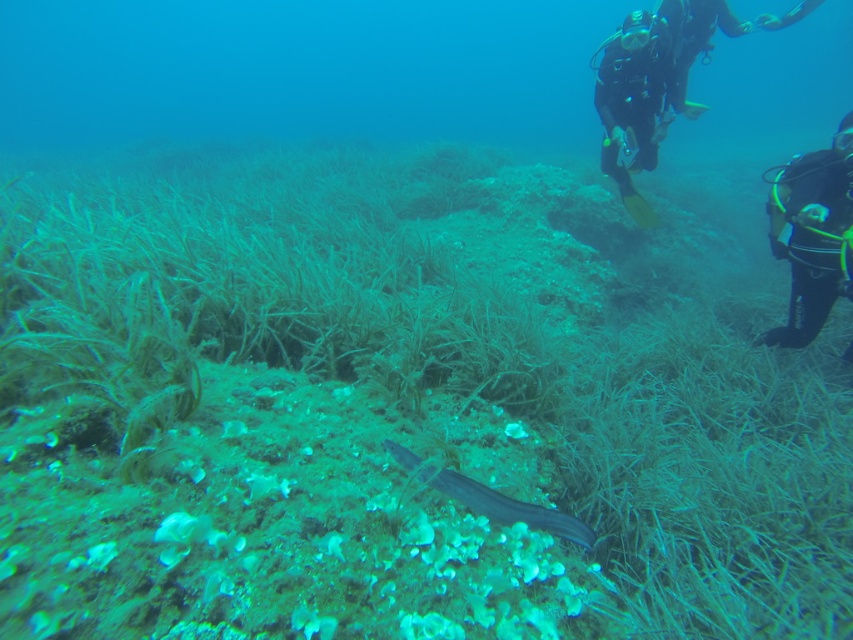
Can you confirm if black neoprene wetsuit at right is smaller than smooth grayish-blue fish at center?

Actually, black neoprene wetsuit at right might be larger than smooth grayish-blue fish at center.

Who is more distant from viewer, (786, 170) or (431, 467)?

Point (786, 170)

You are a GUI agent. You are given a task and a screenshot of the screen. Output one action in this format:
    pyautogui.click(x=<x>, y=<y>)
    Task: Click on the black neoprene wetsuit at right
    
    Given the screenshot: What is the action you would take?
    pyautogui.click(x=811, y=234)